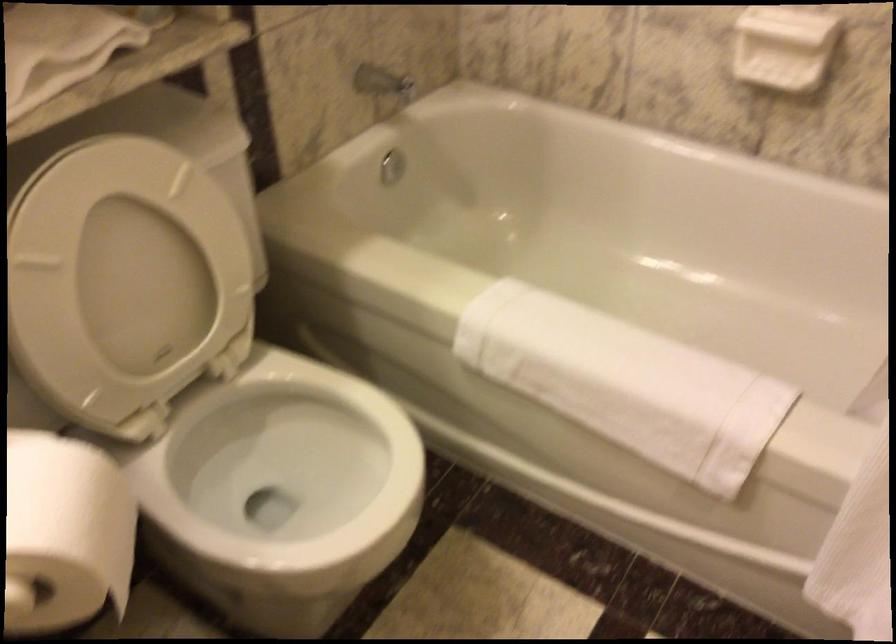
At what (x,y) coordinates should I click in order to perform the action: click on white toilet paper. Please return your answer as a coordinate pair (x, y). Image resolution: width=896 pixels, height=644 pixels. Looking at the image, I should click on (64, 534).